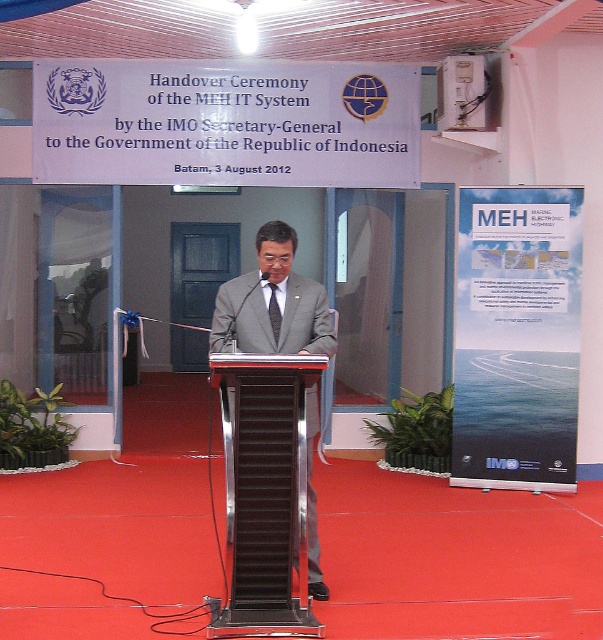
Question: Is blue paperboard poster at center further to the viewer compared to gray suit at center?

Choices:
 (A) no
 (B) yes

Answer: (B)

Question: Does blue paperboard poster at center appear on the left side of black textured tie at center?

Choices:
 (A) yes
 (B) no

Answer: (B)

Question: Is gray suit at center positioned at the back of black textured tie at center?

Choices:
 (A) yes
 (B) no

Answer: (B)

Question: Which object is closer to the camera taking this photo?

Choices:
 (A) gray suit at center
 (B) black textured tie at center
 (C) blue paperboard poster at center

Answer: (A)

Question: Which point is closer to the camera taking this photo?

Choices:
 (A) (298, 301)
 (B) (273, 300)

Answer: (A)

Question: Which of the following is the farthest from the observer?

Choices:
 (A) gray suit at center
 (B) blue paperboard poster at center

Answer: (B)